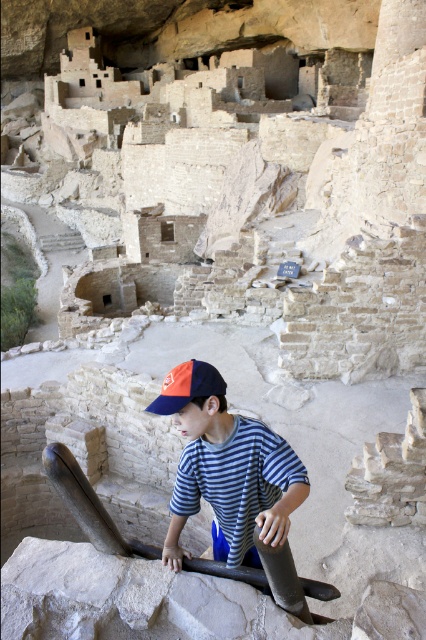
Looking at this image, you are a tour guide standing near the edge of the archaeological site. You notice a striped cotton shirt at center left behind by a visitor. The shirt is 1.5 meters away from the safety railing. Can you safely retrieve it without crossing the safety zone?

The striped cotton shirt at center is 9.98 meters from the viewer. Since the shirt is 1.5 meters away from the safety railing, it is likely within a safe distance to retrieve without crossing the safety zone.